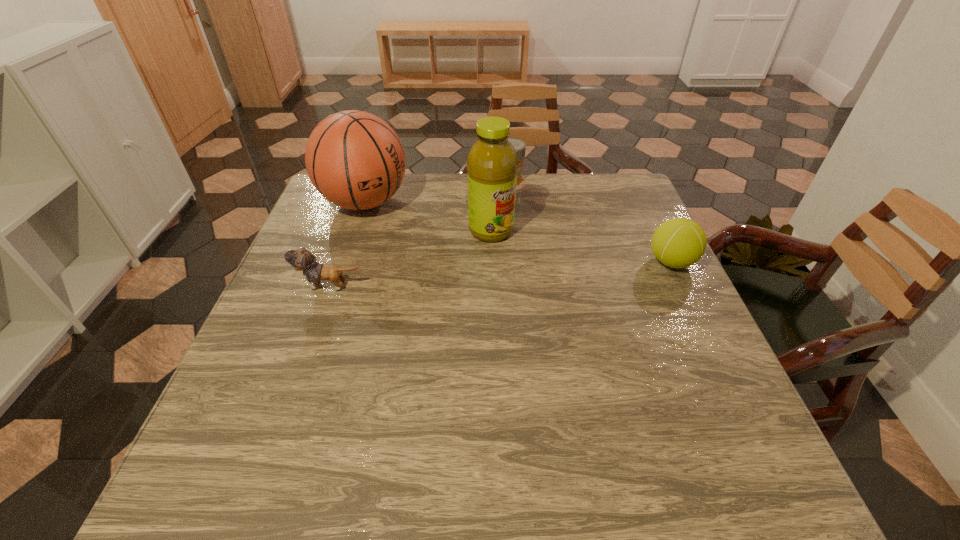
The height and width of the screenshot is (540, 960). In order to click on vacant space that's between the fruit juice and the basketball in this screenshot , I will do `click(428, 217)`.

Find the location of a particular element. empty space that is in between the kitten and the tennis ball is located at coordinates (501, 274).

Image resolution: width=960 pixels, height=540 pixels. Find the location of `empty space between the rightmost object and the fruit juice`. empty space between the rightmost object and the fruit juice is located at coordinates (581, 246).

Where is `free space between the medicine and the kitten`? free space between the medicine and the kitten is located at coordinates (420, 233).

The image size is (960, 540). In order to click on unoccupied position between the rightmost object and the basketball in this screenshot , I will do `click(518, 232)`.

Where is `empty space that is in between the basketball and the kitten`? The image size is (960, 540). empty space that is in between the basketball and the kitten is located at coordinates (348, 244).

Choose which object is the nearest neighbor to the basketball. Please provide its 2D coordinates. Your answer should be formatted as a tuple, i.e. [(x, y)], where the tuple contains the x and y coordinates of a point satisfying the conditions above.

[(492, 163)]

Identify which object is the fourth closest to the basketball. Please provide its 2D coordinates. Your answer should be formatted as a tuple, i.e. [(x, y)], where the tuple contains the x and y coordinates of a point satisfying the conditions above.

[(679, 242)]